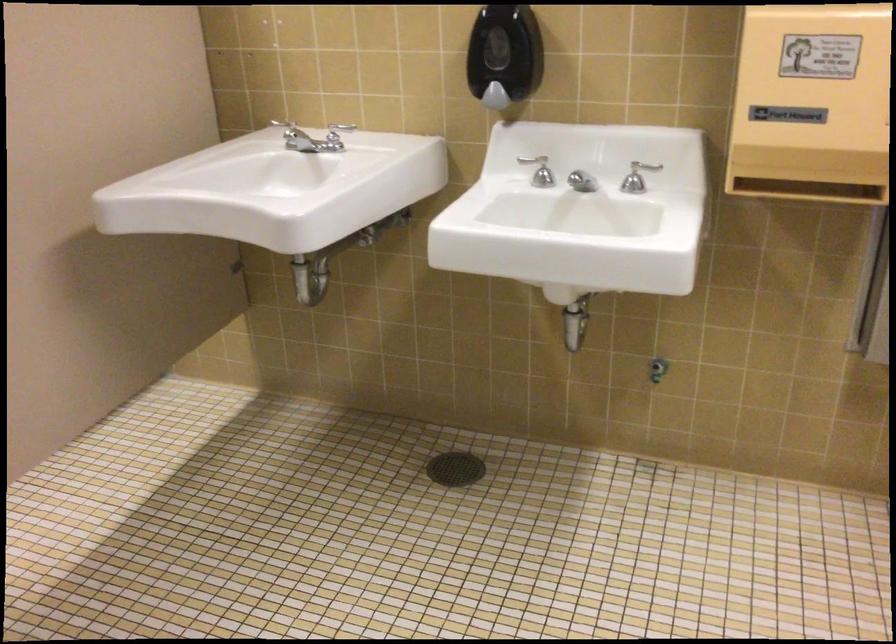
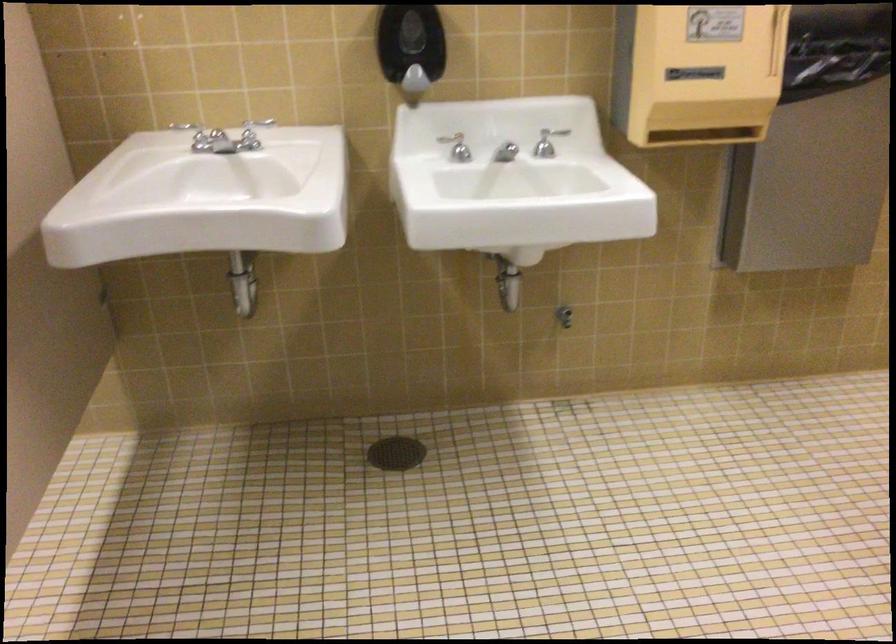
Where in the second image is the point corresponding to (x=547, y=169) from the first image?

(457, 147)